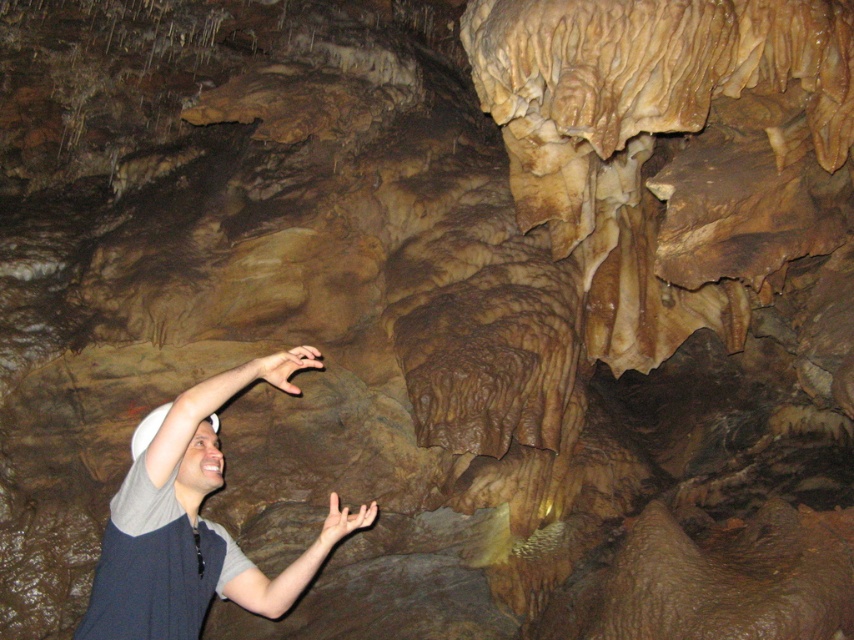
Does pink flesh at center have a greater width compared to matte brown hand at lower center?

Indeed, pink flesh at center has a greater width compared to matte brown hand at lower center.

This screenshot has height=640, width=854. Identify the location of pink flesh at center. (284, 365).

Does gray fabric shirt at lower left come in front of matte brown hand at lower center?

That is True.

Looking at this image, who is positioned more to the right, gray fabric shirt at lower left or matte brown hand at lower center?

matte brown hand at lower center is more to the right.

In order to click on gray fabric shirt at lower left in this screenshot , I will do `click(179, 534)`.

Between gray fabric shirt at lower left and pink flesh at center, which one is positioned higher?

pink flesh at center is higher up.

Based on the photo, between gray fabric shirt at lower left and pink flesh at center, which one is positioned lower?

Positioned lower is gray fabric shirt at lower left.

Between point (192, 392) and point (287, 392), which one is positioned in front?

Point (192, 392)

In order to click on gray fabric shirt at lower left in this screenshot , I will do `click(179, 534)`.